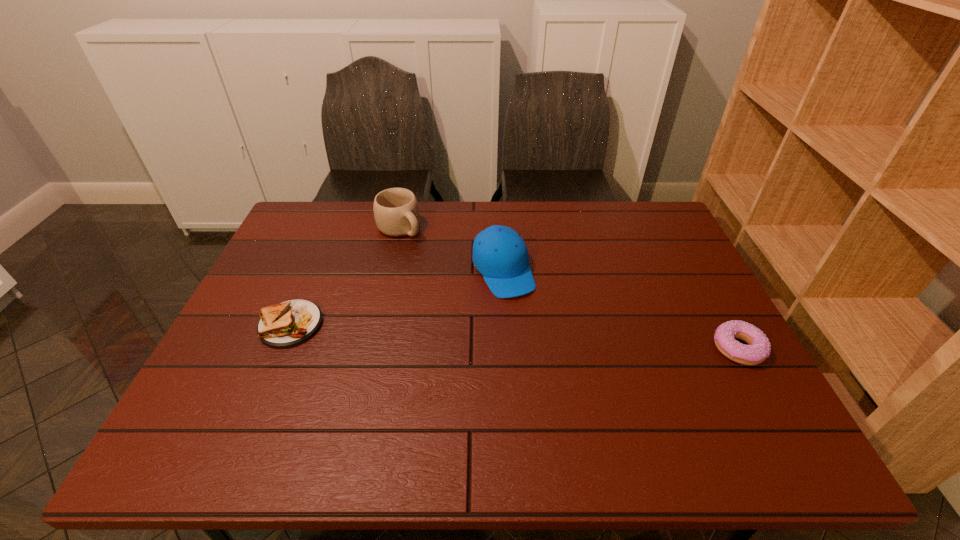
Find the location of a particular element. This screenshot has height=540, width=960. vacant space on the desktop that is between the leftmost object and the doughnut and is positioned on the side of the mug with the handle is located at coordinates (534, 338).

You are a GUI agent. You are given a task and a screenshot of the screen. Output one action in this format:
    pyautogui.click(x=<x>, y=<y>)
    Task: Click on the free space on the desktop that is between the sandwich and the doughnut and is positioned on the front-facing side of the second object from right to left
    Image resolution: width=960 pixels, height=540 pixels.
    Given the screenshot: What is the action you would take?
    pyautogui.click(x=541, y=338)